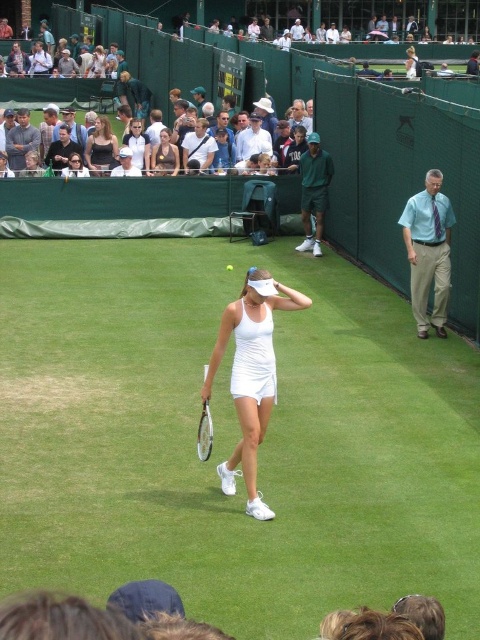
Question: Among these objects, which one is farthest from the camera?

Choices:
 (A) white matte tennis outfit at center
 (B) white fabric tennis court at center
 (C) white matte tennis racket at center

Answer: (A)

Question: Considering the relative positions of white fabric tennis court at center and white fabric tennis ball at center in the image provided, where is white fabric tennis court at center located with respect to white fabric tennis ball at center?

Choices:
 (A) above
 (B) below

Answer: (B)

Question: Does white matte tennis racket at center come in front of white fabric tennis ball at center?

Choices:
 (A) yes
 (B) no

Answer: (A)

Question: Is white fabric tennis outfit at center in front of white fabric tennis ball at center?

Choices:
 (A) yes
 (B) no

Answer: (B)

Question: Which point is closer to the camera?

Choices:
 (A) (105, 170)
 (B) (226, 320)
 (C) (163, 141)

Answer: (B)

Question: Which of the following is the farthest from the observer?

Choices:
 (A) white matte tennis racket at center
 (B) white matte tennis outfit at center

Answer: (B)